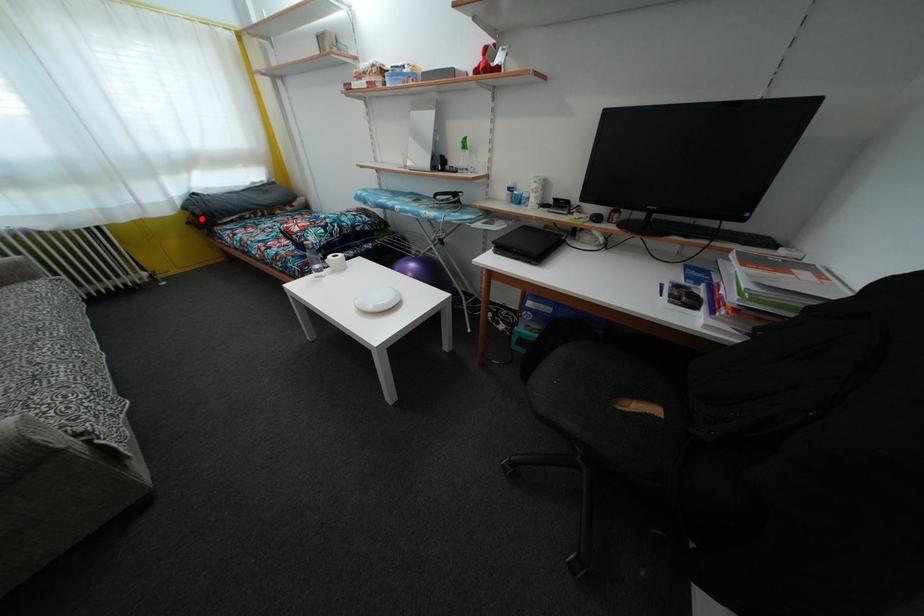
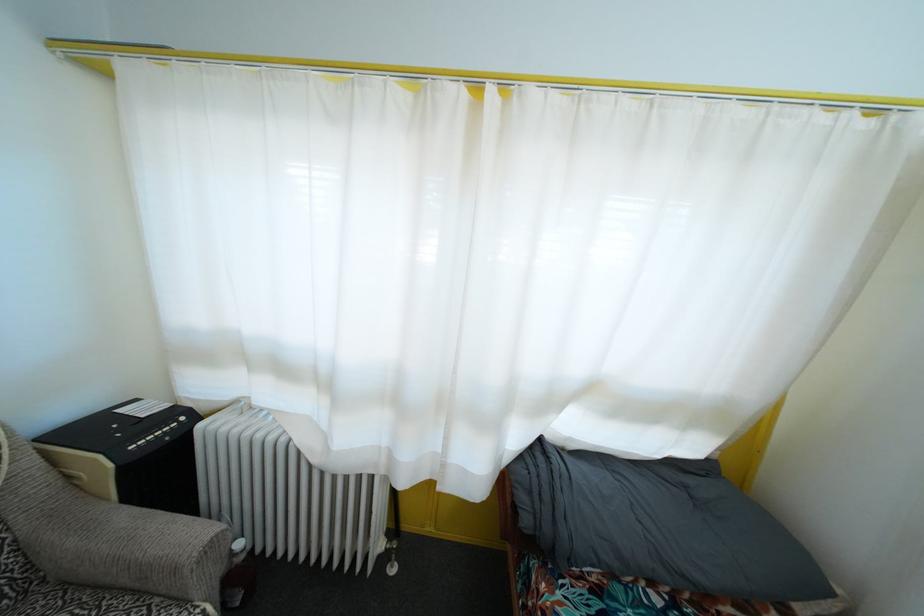
In the second image, find the point that corresponds to the highlighted location in the first image.

(529, 528)